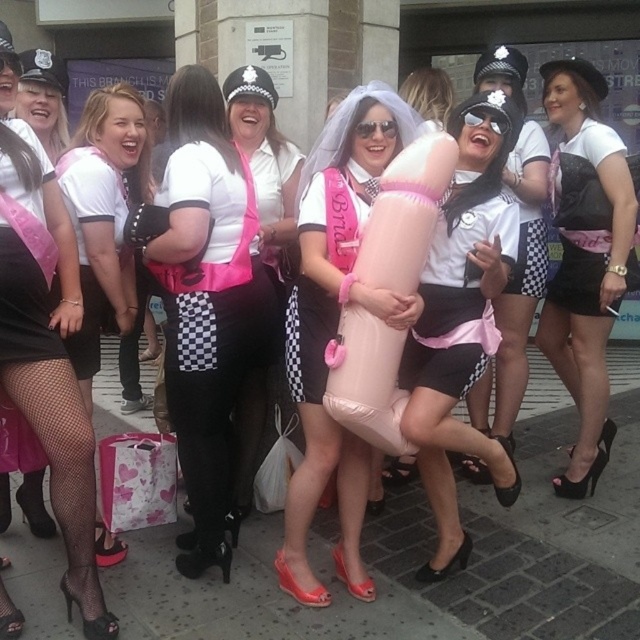
You are a photographer trying to capture a clear shot of both the black leather skirt at center and the matte pink veil at center. Since you want to ensure both are visible in your frame, which object should you focus on first to avoid blurring either?

The black leather skirt at center is positioned on the right side of matte pink veil at center, so you should focus on the matte pink veil at center first as it is closer to the left side and might require adjustment to ensure both remain in focus.

You are a photographer trying to capture the pink fabric vest at center in the image. Based on its coordinates, where should you aim your camera?

The pink fabric vest at center is located at coordinates point [266,164], so aim your camera there to capture it.